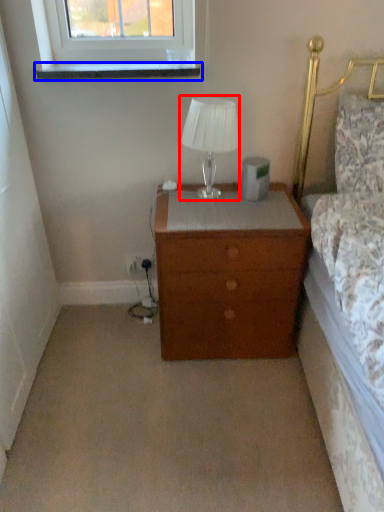
Question: Which object appears closest to the camera in this image, table lamp (highlighted by a red box) or window sill (highlighted by a blue box)?

Choices:
 (A) table lamp
 (B) window sill

Answer: (A)